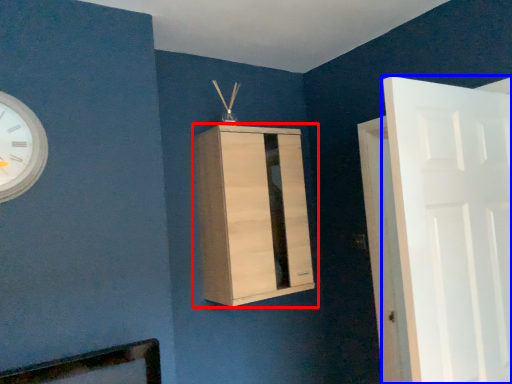
Question: Which object appears closest to the camera in this image, cupboard (highlighted by a red box) or door (highlighted by a blue box)?

Choices:
 (A) cupboard
 (B) door

Answer: (B)